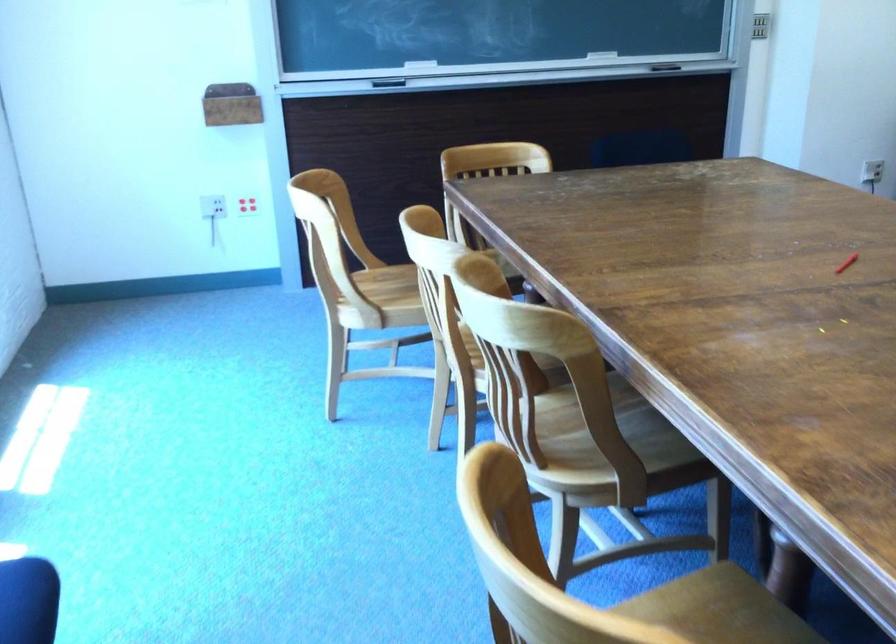
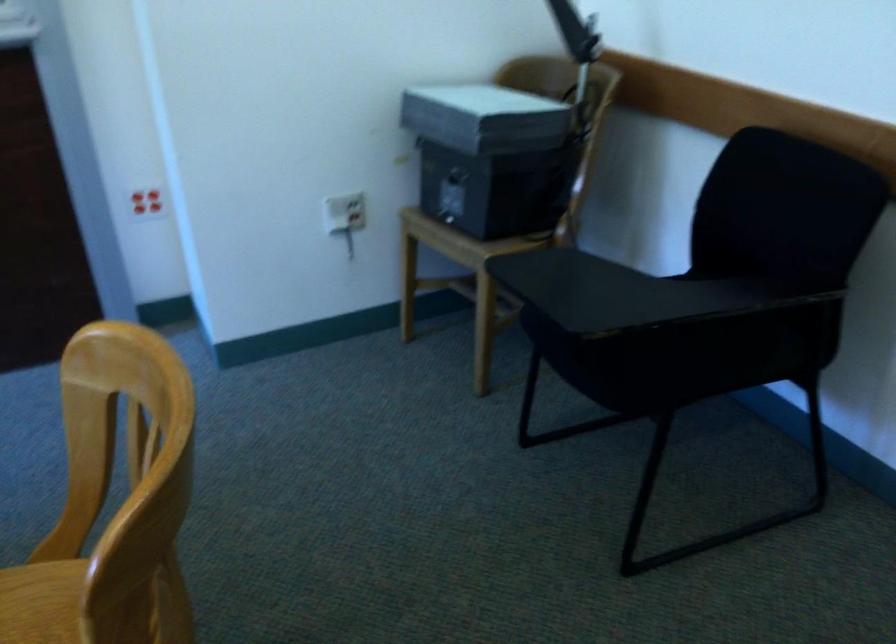
Which direction would the cameraman need to move to produce the second image?

The movement direction of the cameraman is right, forward.